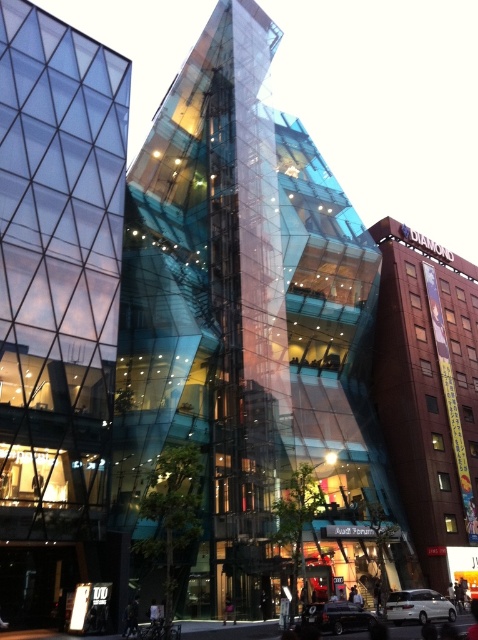
Question: Is white glossy car at lower center to the right of shiny black car at lower center from the viewer's perspective?

Choices:
 (A) yes
 (B) no

Answer: (A)

Question: From the image, what is the correct spatial relationship of white glossy car at lower center in relation to shiny black car at lower center?

Choices:
 (A) below
 (B) above

Answer: (A)

Question: Does white glossy car at lower center appear under shiny black car at lower center?

Choices:
 (A) yes
 (B) no

Answer: (A)

Question: Which point is closer to the camera?

Choices:
 (A) (397, 596)
 (B) (368, 616)

Answer: (B)